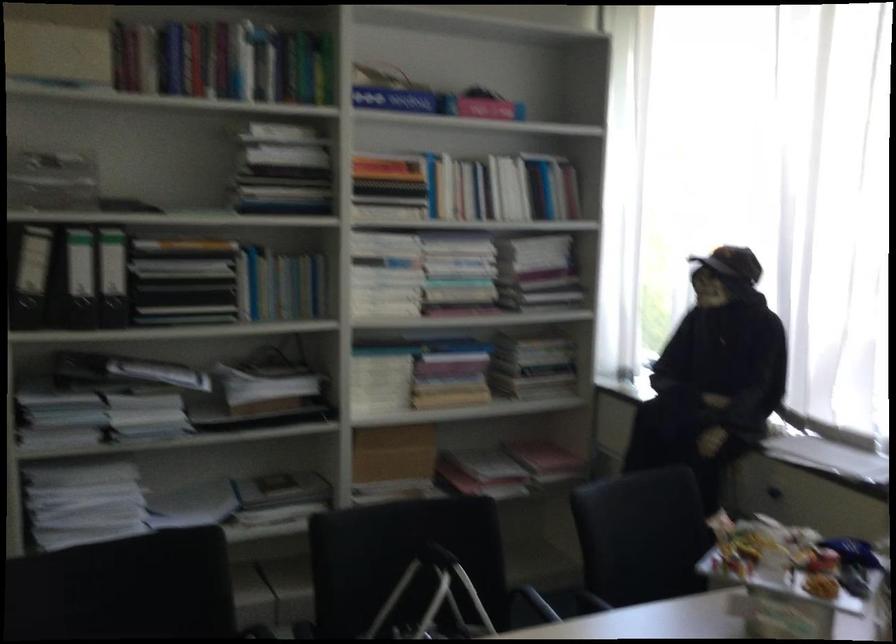
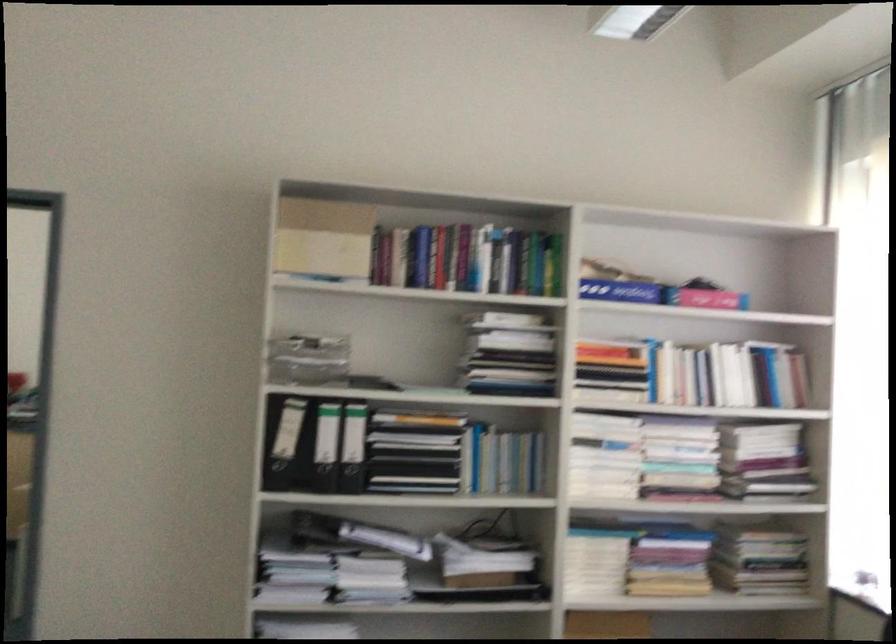
Question: What movement of the cameraman would produce the second image?

Choices:
 (A) Left
 (B) Right
 (C) Forward
 (D) Backward

Answer: (A)